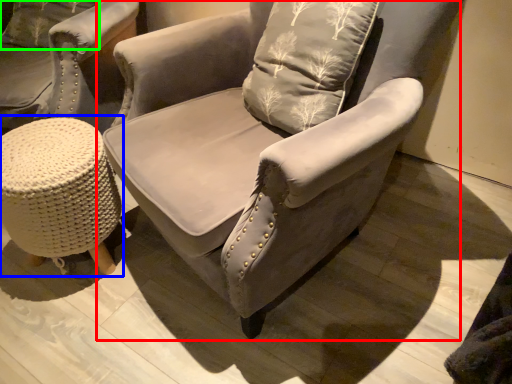
Question: Which object is positioned farthest from chair (highlighted by a red box)? Select from music stool (highlighted by a blue box) and pillow (highlighted by a green box).

Choices:
 (A) music stool
 (B) pillow

Answer: (B)